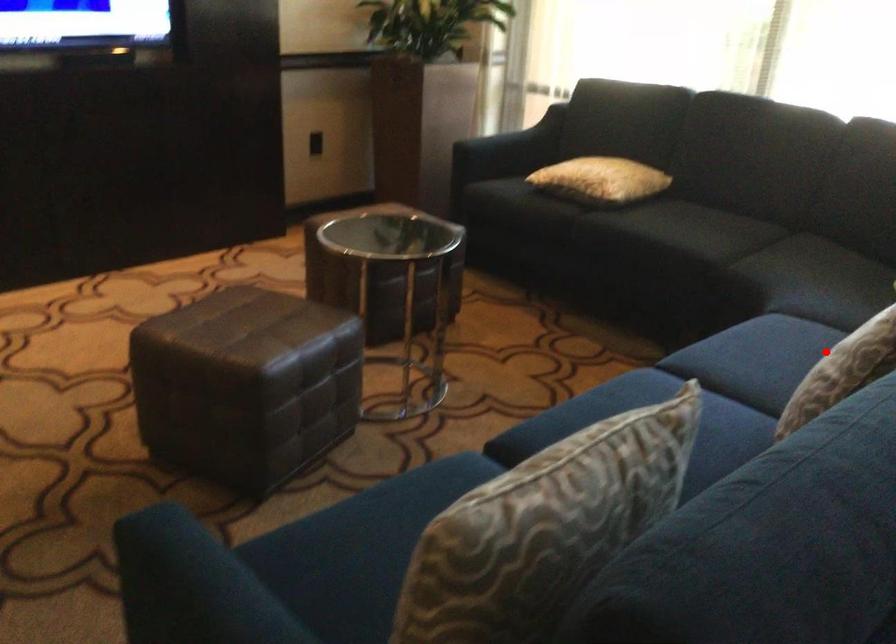
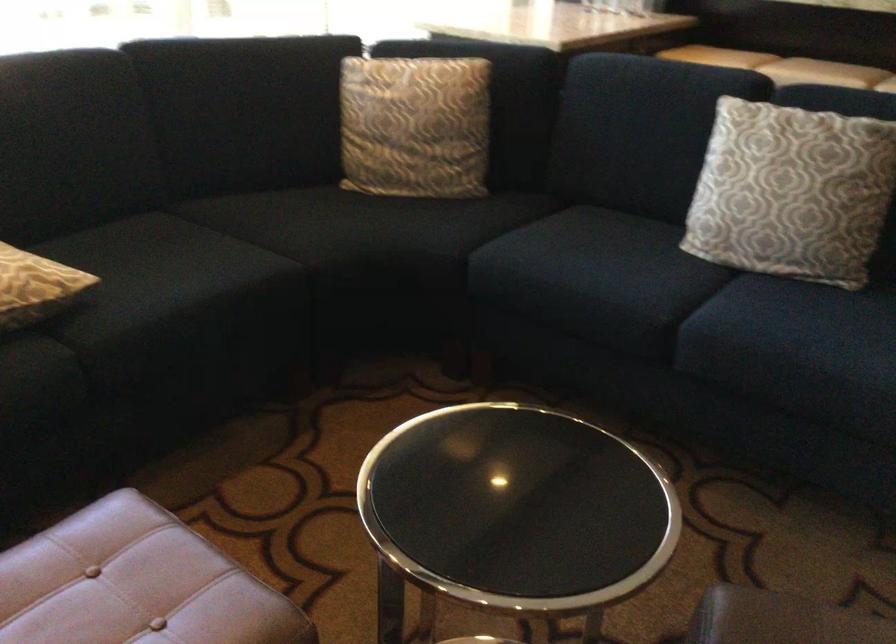
Question: I am providing you with two images of the same scene from different viewpoints. Given a red point in image1, look at the same physical point in image2. Is it:

Choices:
 (A) Closer to the viewpoint
 (B) Farther from the viewpoint

Answer: (B)